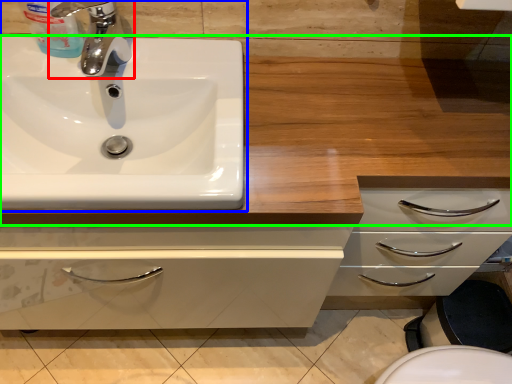
Question: Which object is the farthest from tap (highlighted by a red box)? Choose among these: sink (highlighted by a blue box) or counter top (highlighted by a green box).

Choices:
 (A) sink
 (B) counter top

Answer: (B)